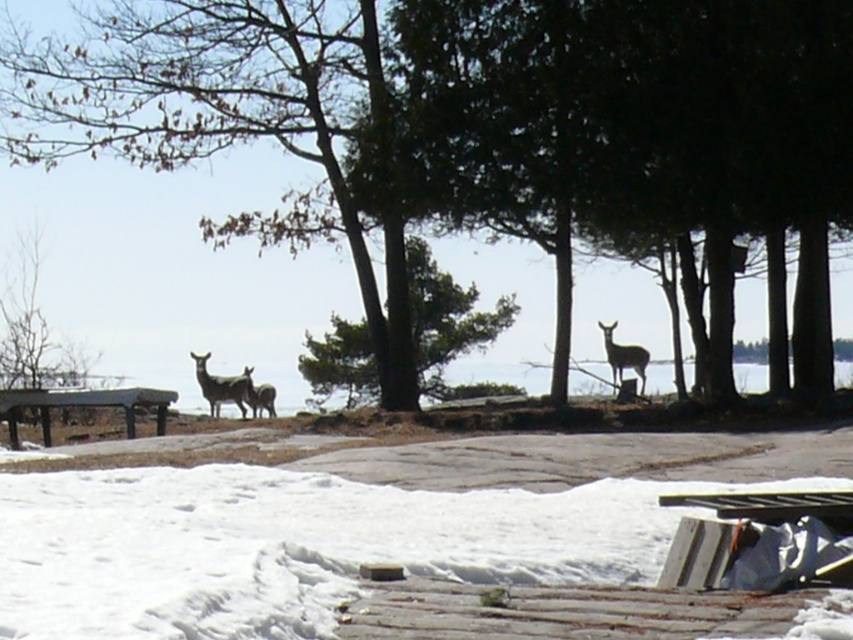
You are planning to set up a small campfire in this scene. You have a firewood pile that needs to be placed to the right of the brown matte deer at center. Can you place it to the right of the wooden picnic table at lower left?

The wooden picnic table at lower left is positioned on the left side of brown matte deer at center. Therefore, placing the firewood pile to the right of the brown matte deer at center would also place it to the right of the wooden picnic table at lower left, so yes, it can be done.